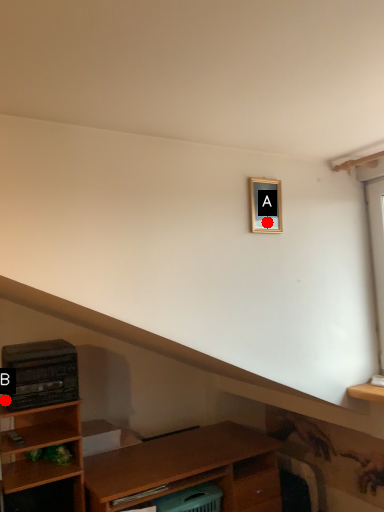
Question: Two points are circled on the image, labeled by A and B beside each circle. Among these points, which one is nearest to the camera?

Choices:
 (A) A is closer
 (B) B is closer

Answer: (A)